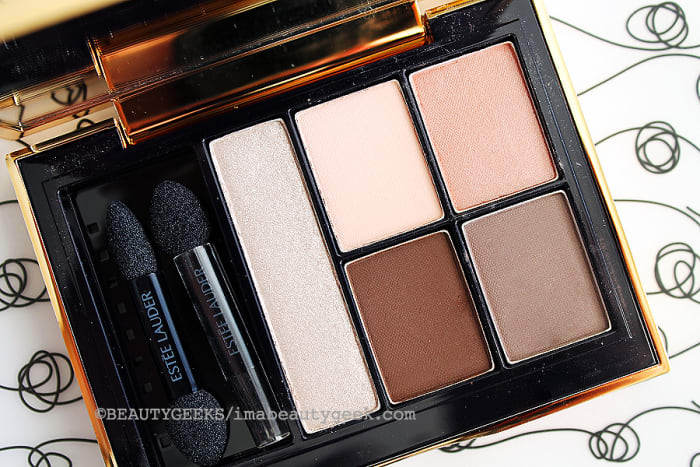
Where is `white tabletop`? Image resolution: width=700 pixels, height=467 pixels. white tabletop is located at coordinates (647, 240).